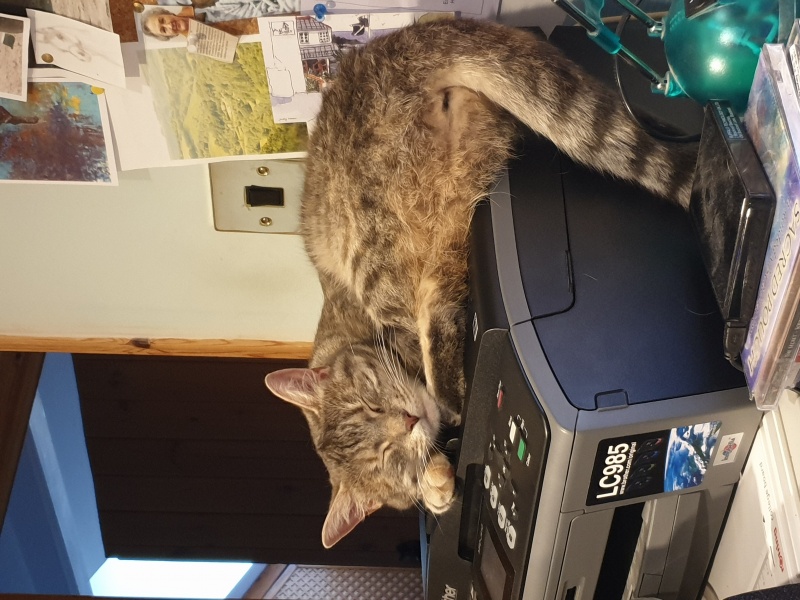
The image size is (800, 600). I want to click on tan wall, so click(x=220, y=273).